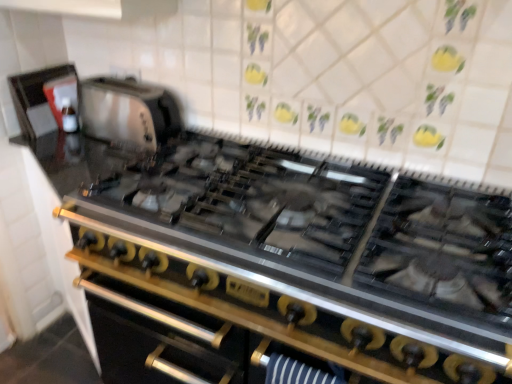
Question: From a real-world perspective, is satin silver toaster at upper left, which is counted as the second appliance, starting from the left, physically located above or below stainless steel oven at center?

Choices:
 (A) below
 (B) above

Answer: (B)

Question: Which is correct: satin silver toaster at upper left, which appears as the first appliance when viewed from the right, is inside stainless steel oven at center, or outside of it?

Choices:
 (A) inside
 (B) outside

Answer: (B)

Question: Estimate the real-world distances between objects in this image. Which object is closer to the satin silver toaster at upper left, which appears as the first appliance when viewed from the right?

Choices:
 (A) stainless steel gas stove at center
 (B) stainless steel oven at center
 (C) matte black kettle at upper left, marked as the 2th appliance in a right-to-left arrangement

Answer: (C)

Question: Which of these objects is positioned farthest from the stainless steel oven at center?

Choices:
 (A) matte black kettle at upper left, which ranks as the 1th appliance in left-to-right order
 (B) stainless steel gas stove at center
 (C) satin silver toaster at upper left, which appears as the first appliance when viewed from the right

Answer: (A)